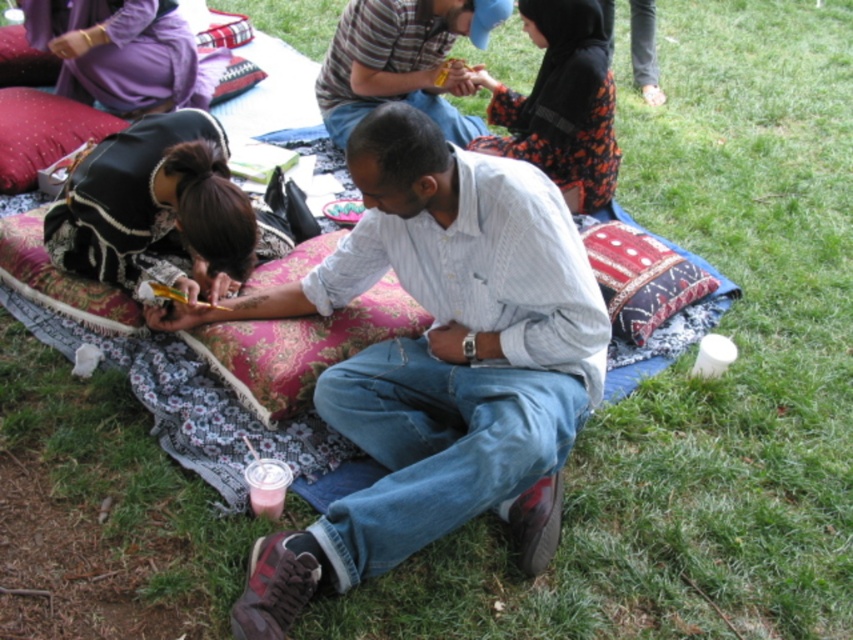
You are standing at point (532, 320) and want to walk to point (36, 76). Which direction should you move in to get closer to your destination?

To move from point (532, 320) to point (36, 76), you should move downward and to the left since point (36, 76) is located below and to the left of point (532, 320).

From the picture: You are a photographer standing at the origin point of the image coordinate system. You need to capture a photo of the black lace dress at center. What are the coordinates where you should aim your camera?

The coordinates to aim your camera are at point (155, 209) as that is where the black lace dress at center is located.